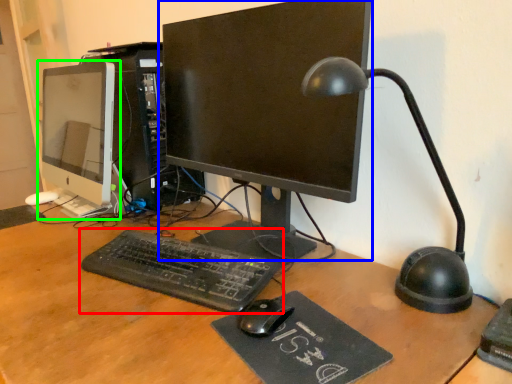
Question: Which object is the farthest from computer keyboard (highlighted by a red box)? Choose among these: computer monitor (highlighted by a blue box) or computer monitor (highlighted by a green box).

Choices:
 (A) computer monitor
 (B) computer monitor

Answer: (B)